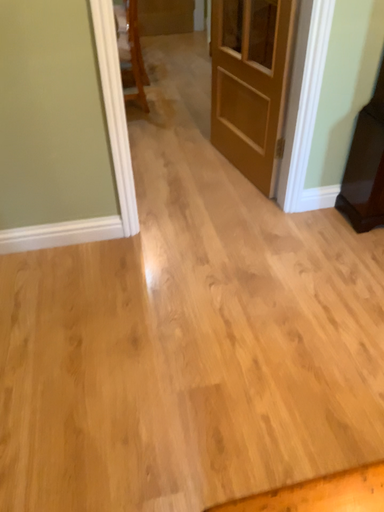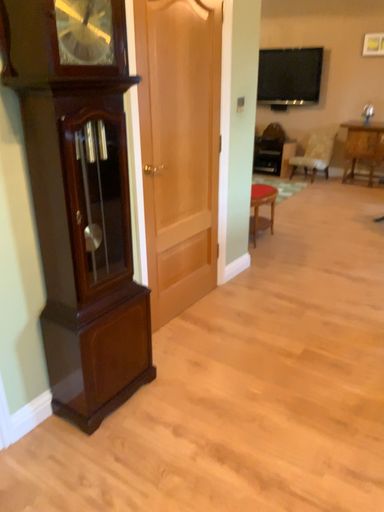
Question: Which way did the camera rotate in the video?

Choices:
 (A) rotated left
 (B) rotated right

Answer: (B)